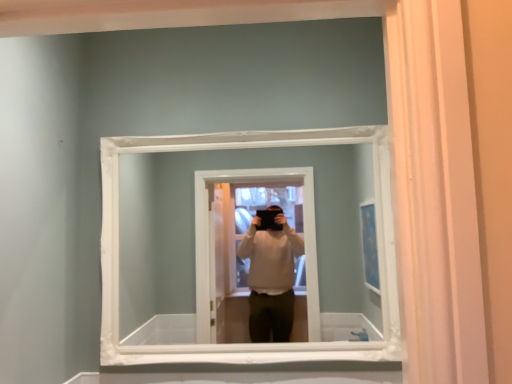
This screenshot has width=512, height=384. I want to click on white glossy mirror at center, so (x=194, y=225).

Describe the element at coordinates (194, 225) in the screenshot. I see `white glossy mirror at center` at that location.

In order to face white glossy mirror at center, should I rotate leftwards or rightwards?

Rotate left and turn 1.508 degrees.

The height and width of the screenshot is (384, 512). I want to click on white glossy mirror at center, so [194, 225].